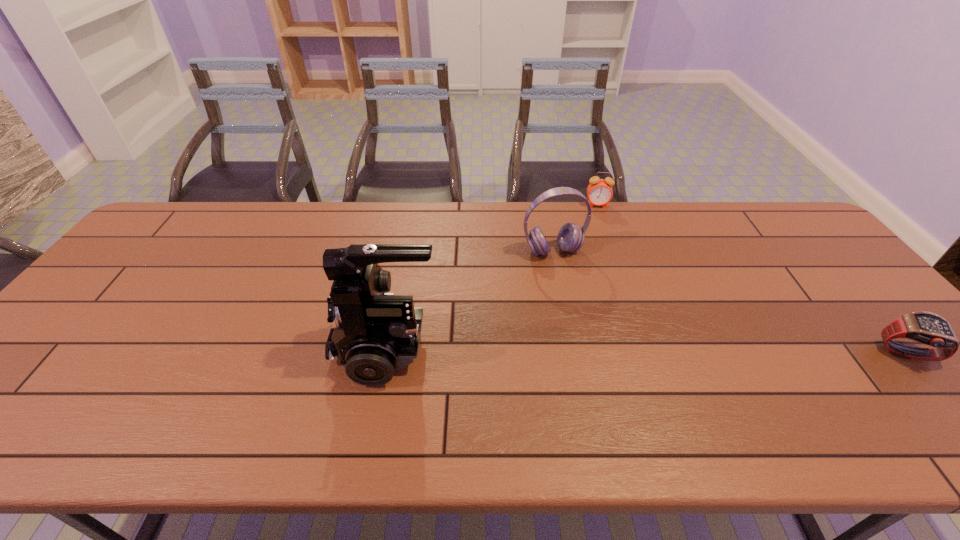
In order to click on camcorder in this screenshot , I will do `click(375, 333)`.

I want to click on the leftmost object, so click(x=375, y=333).

Find the location of a particular element. The image size is (960, 540). the shortest object is located at coordinates (928, 328).

Image resolution: width=960 pixels, height=540 pixels. I want to click on the rightmost object, so click(928, 328).

Where is `the third nearest object`? The image size is (960, 540). the third nearest object is located at coordinates (570, 238).

This screenshot has width=960, height=540. Find the location of `the third shortest object`. the third shortest object is located at coordinates (570, 238).

The width and height of the screenshot is (960, 540). I want to click on the third object from left to right, so click(x=599, y=191).

The height and width of the screenshot is (540, 960). Find the location of `the second shortest object`. the second shortest object is located at coordinates (599, 191).

Find the location of `free region located 0.090m on the lens mount of the camcorder`. free region located 0.090m on the lens mount of the camcorder is located at coordinates [296, 348].

The height and width of the screenshot is (540, 960). Find the location of `free location located 0.230m on the lens mount of the camcorder`. free location located 0.230m on the lens mount of the camcorder is located at coordinates (238, 348).